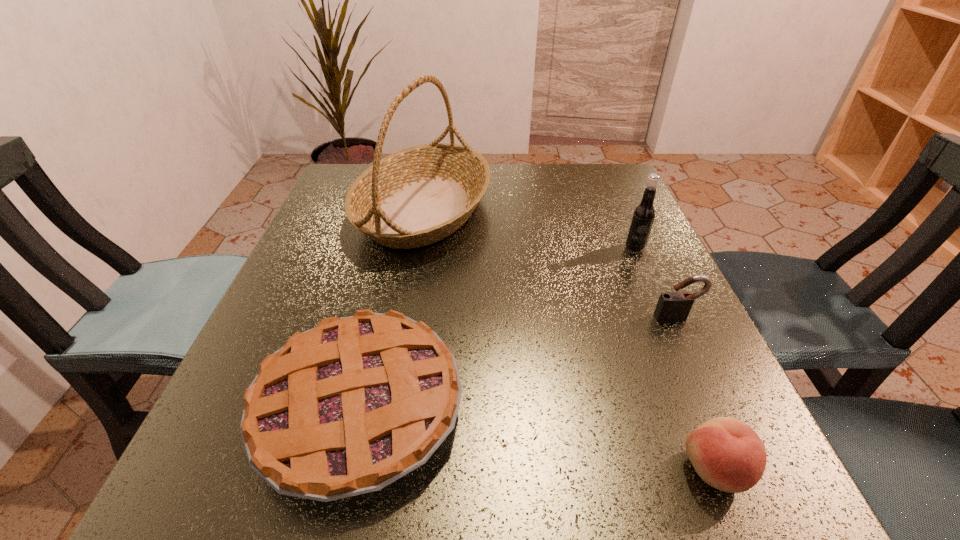
Locate an element on the screen. blank space located 0.170m on the right of the pie is located at coordinates (582, 407).

Where is `object that is at the far edge`? This screenshot has height=540, width=960. object that is at the far edge is located at coordinates (420, 195).

The width and height of the screenshot is (960, 540). I want to click on peach positioned at the near edge, so click(x=727, y=454).

You are a GUI agent. You are given a task and a screenshot of the screen. Output one action in this format:
    pyautogui.click(x=<x>, y=<y>)
    Task: Click on the pie positioned at the near edge
    This screenshot has width=960, height=540.
    Given the screenshot: What is the action you would take?
    pyautogui.click(x=346, y=408)

Locate an element on the screen. basket located in the left edge section of the desktop is located at coordinates (420, 195).

Where is `pie located at the left edge`? The image size is (960, 540). pie located at the left edge is located at coordinates (346, 408).

At what (x,y) coordinates should I click in order to perform the action: click on root beer that is at the right edge. Please return your answer as a coordinate pair (x, y). The height and width of the screenshot is (540, 960). Looking at the image, I should click on (644, 213).

Identify the location of padlock at the right edge. (672, 306).

Find the location of `peach present at the right edge`. peach present at the right edge is located at coordinates (727, 454).

In order to click on object at the far left corner in this screenshot , I will do `click(420, 195)`.